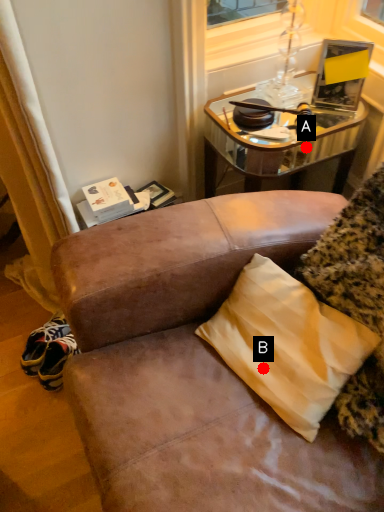
Question: Two points are circled on the image, labeled by A and B beside each circle. Among these points, which one is farthest from the camera?

Choices:
 (A) A is further
 (B) B is further

Answer: (A)